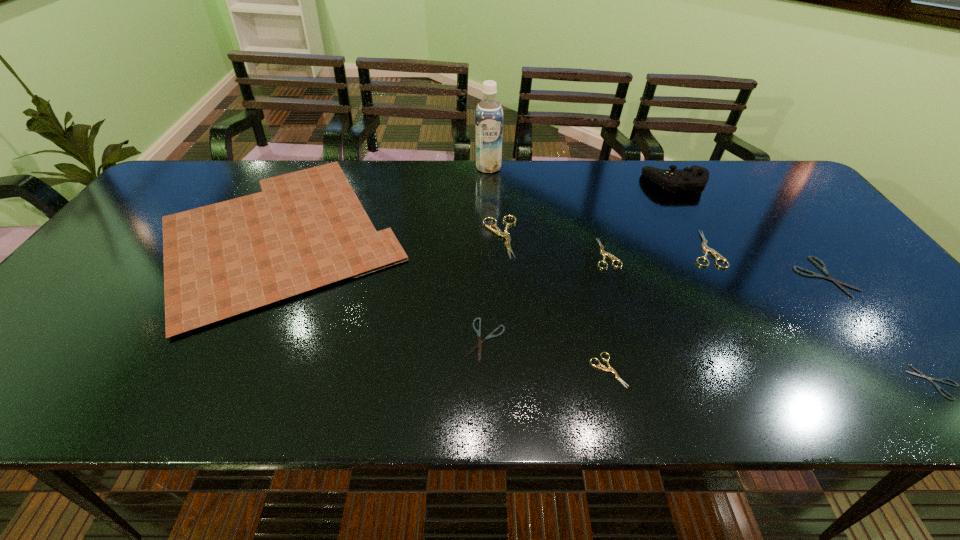
You are a GUI agent. You are given a task and a screenshot of the screen. Output one action in this format:
    pyautogui.click(x=<x>, y=<y>)
    Task: Click on the vacant space located 0.300m on the right of the fourth shears from right to left
    This screenshot has height=540, width=960.
    Given the screenshot: What is the action you would take?
    pyautogui.click(x=733, y=253)

Where is `vacant space situated 0.060m on the left of the biggest black shears`? The height and width of the screenshot is (540, 960). vacant space situated 0.060m on the left of the biggest black shears is located at coordinates (775, 277).

Identify the location of vacant point located 0.340m on the left of the nearest beige shears. The image size is (960, 540). (425, 370).

Where is `free spot located on the left of the second farthest black shears`? free spot located on the left of the second farthest black shears is located at coordinates (419, 340).

The height and width of the screenshot is (540, 960). In order to click on soya milk that is at the far edge in this screenshot , I will do `click(489, 114)`.

You are a GUI agent. You are given a task and a screenshot of the screen. Output one action in this format:
    pyautogui.click(x=<x>, y=<y>)
    Task: Click on the control present at the far edge
    
    Given the screenshot: What is the action you would take?
    pyautogui.click(x=695, y=178)

This screenshot has height=540, width=960. In order to click on gameboard that is at the far edge in this screenshot , I will do `click(306, 229)`.

Find the location of `object located in the near edge section of the desktop`. object located in the near edge section of the desktop is located at coordinates (610, 369).

Locate an element on the screen. This screenshot has width=960, height=540. object present at the left edge is located at coordinates (306, 229).

The image size is (960, 540). In order to click on object at the right edge in this screenshot , I will do `click(823, 268)`.